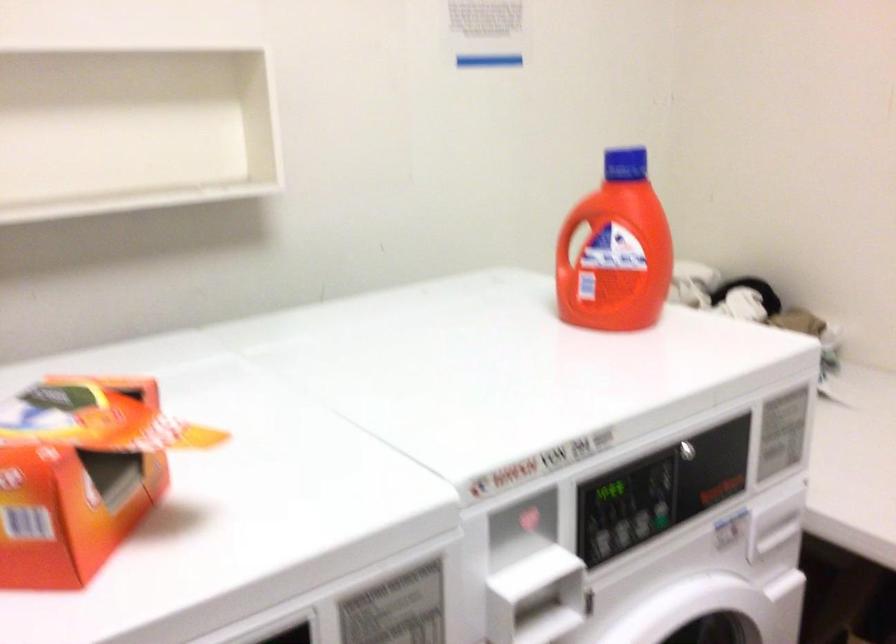
I want to click on blue bottle cap, so click(625, 164).